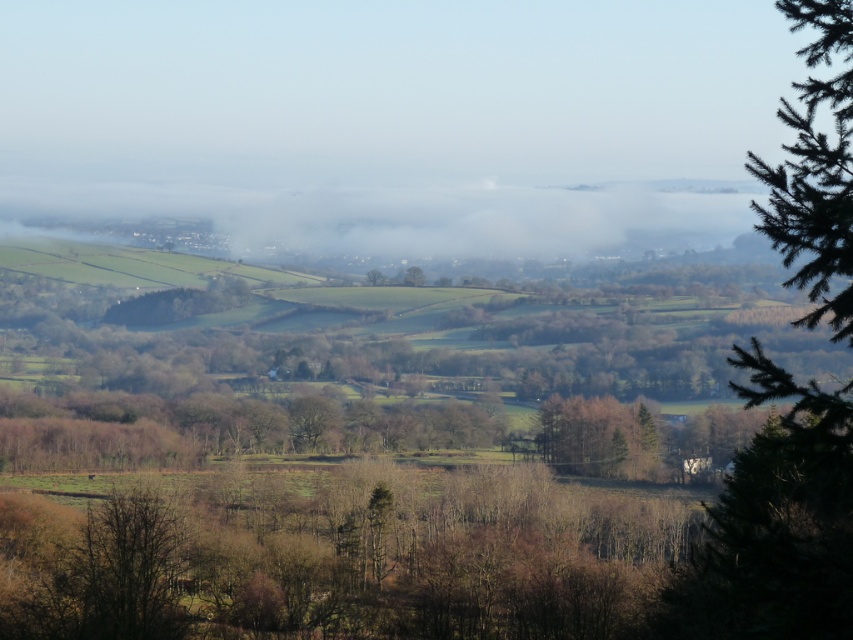
Question: Does brown matte tree at center appear on the left side of green matte tree at center?

Choices:
 (A) yes
 (B) no

Answer: (B)

Question: Among these points, which one is farthest from the camera?

Choices:
 (A) (386, 275)
 (B) (415, 268)
 (C) (767, 396)
 (D) (653, 470)

Answer: (A)

Question: Which object is closer to the camera taking this photo?

Choices:
 (A) green leafy tree at right
 (B) green leafy tree at center
 (C) green matte tree at center

Answer: (A)

Question: Does green leafy tree at right come behind green leafy tree at center?

Choices:
 (A) yes
 (B) no

Answer: (B)

Question: Which point is closer to the camera taking this photo?

Choices:
 (A) (549, 432)
 (B) (381, 280)

Answer: (A)

Question: Is green leafy tree at center positioned behind green matte tree at center?

Choices:
 (A) no
 (B) yes

Answer: (A)